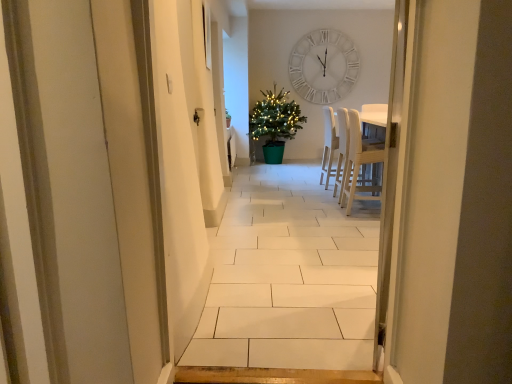
Question: Considering their positions, is green matte potted plant at center located in front of or behind light wood chair at center?

Choices:
 (A) front
 (B) behind

Answer: (B)

Question: From the image's perspective, is green matte potted plant at center above or below light wood chair at center?

Choices:
 (A) below
 (B) above

Answer: (B)

Question: Which is farther from the white wood chairs at center?

Choices:
 (A) light wood chair at center
 (B) white wooden clock at upper center
 (C) green matte potted plant at center

Answer: (B)

Question: Estimate the real-world distances between objects in this image. Which object is farther from the light wood chair at center?

Choices:
 (A) white wooden clock at upper center
 (B) green matte potted plant at center
 (C) white wood chairs at center

Answer: (A)